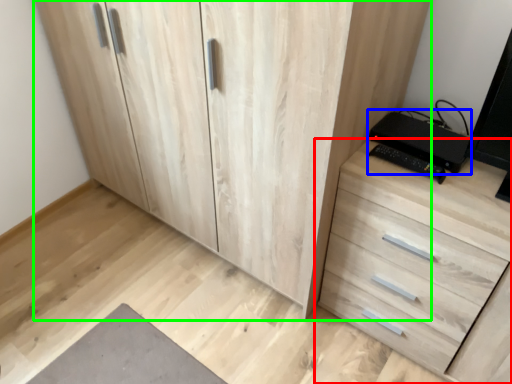
Question: Considering the real-world distances, which object is farthest from chest of drawers (highlighted by a red box)? computer (highlighted by a blue box) or cupboard (highlighted by a green box)?

Choices:
 (A) computer
 (B) cupboard

Answer: (B)